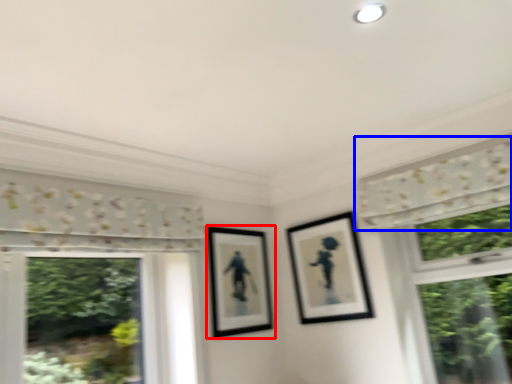
Question: Which object appears farthest to the camera in this image, picture frame (highlighted by a red box) or curtain (highlighted by a blue box)?

Choices:
 (A) picture frame
 (B) curtain

Answer: (A)